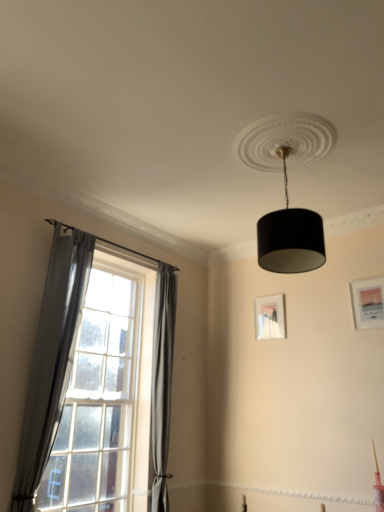
Locate an element on the screen. The height and width of the screenshot is (512, 384). clear glass window at left is located at coordinates (80, 385).

Describe the element at coordinates (80, 385) in the screenshot. The height and width of the screenshot is (512, 384). I see `clear glass window at left` at that location.

In order to face gray fabric curtain at left, the 1th curtain when ordered from front to back, should I rotate leftwards or rightwards?

You should look left and rotate roughly 17.153 degrees.

At what (x,y) coordinates should I click in order to perform the action: click on black textured lampshade at upper center. Please return your answer as a coordinate pair (x, y). Looking at the image, I should click on (290, 234).

Where is `clear glass window at left`? This screenshot has width=384, height=512. clear glass window at left is located at coordinates (80, 385).

Considering the relative sizes of clear glass window at left and gray fabric curtain at left, which is the 2th curtain from right to left, in the image provided, is clear glass window at left shorter than gray fabric curtain at left, which is the 2th curtain from right to left,?

In fact, clear glass window at left may be taller than gray fabric curtain at left, which is the 2th curtain from right to left.

Which object is further away from the camera, clear glass window at left or gray fabric curtain at left, arranged as the 1th curtain when viewed from the left?

Positioned behind is clear glass window at left.

How different are the orientations of clear glass window at left and gray fabric curtain at left, arranged as the 1th curtain when viewed from the left, in degrees?

The facing directions of clear glass window at left and gray fabric curtain at left, arranged as the 1th curtain when viewed from the left, are 3.49e-05 degrees apart.

How distant is clear glass window at left from gray fabric curtain at left, which is the 2th curtain from right to left?

The distance of clear glass window at left from gray fabric curtain at left, which is the 2th curtain from right to left, is 66.74 centimeters.

Looking at this image, from the image's perspective, is gray fabric curtain at left, the 2th curtain positioned from the front, located above matte white picture frame at center, positioned as the second picture frame in right-to-left order?

No, from the image's perspective, gray fabric curtain at left, the 2th curtain positioned from the front, is not above matte white picture frame at center, positioned as the second picture frame in right-to-left order.

Is gray fabric curtain at left, acting as the 1th curtain starting from the back, oriented away from matte white picture frame at center, the first picture frame from the left?

No.

Which of these two, gray fabric curtain at left, acting as the 1th curtain starting from the back, or matte white picture frame at center, positioned as the second picture frame in right-to-left order, is smaller?

matte white picture frame at center, positioned as the second picture frame in right-to-left order, is smaller.

Based on the photo, is the position of matte white picture frame at upper right, which ranks as the second picture frame in back-to-front order, less distant than that of black textured lampshade at upper center?

No, matte white picture frame at upper right, which ranks as the second picture frame in back-to-front order, is further to the viewer.

From the image's perspective, which is below, matte white picture frame at upper right, which ranks as the second picture frame in back-to-front order, or black textured lampshade at upper center?

matte white picture frame at upper right, which ranks as the second picture frame in back-to-front order, is shown below in the image.

Who is smaller, matte white picture frame at upper right, arranged as the second picture frame when viewed from the left, or black textured lampshade at upper center?

matte white picture frame at upper right, arranged as the second picture frame when viewed from the left.

Which is closer to the camera, (369, 324) or (315, 255)?

Point (369, 324) is farther from the camera than point (315, 255).

Looking at this image, is matte white picture frame at center, acting as the 1th picture frame starting from the back, surrounding gray fabric curtain at left, which is the second curtain from back to front?

That's incorrect, gray fabric curtain at left, which is the second curtain from back to front, is not inside matte white picture frame at center, acting as the 1th picture frame starting from the back.

From a real-world perspective, is matte white picture frame at center, positioned as the second picture frame in right-to-left order, positioned above or below gray fabric curtain at left, which is the second curtain from back to front?

In terms of real-world spatial position, matte white picture frame at center, positioned as the second picture frame in right-to-left order, is above gray fabric curtain at left, which is the second curtain from back to front.

Which object is thinner, matte white picture frame at center, positioned as the second picture frame in right-to-left order, or gray fabric curtain at left, which is the second curtain from back to front?

matte white picture frame at center, positioned as the second picture frame in right-to-left order.

In the scene shown: Is matte white picture frame at center, which ranks as the second picture frame in front-to-back order, beside gray fabric curtain at left, which is the 2th curtain from right to left?

No, matte white picture frame at center, which ranks as the second picture frame in front-to-back order, is not touching gray fabric curtain at left, which is the 2th curtain from right to left.

Considering the sizes of objects gray fabric curtain at left, which is the second curtain from back to front, and matte white picture frame at center, positioned as the second picture frame in right-to-left order, in the image provided, who is thinner, gray fabric curtain at left, which is the second curtain from back to front, or matte white picture frame at center, positioned as the second picture frame in right-to-left order,?

matte white picture frame at center, positioned as the second picture frame in right-to-left order.

From a real-world perspective, is gray fabric curtain at left, which is the 2th curtain from right to left, located higher than matte white picture frame at center, acting as the 1th picture frame starting from the back?

Actually, gray fabric curtain at left, which is the 2th curtain from right to left, is physically below matte white picture frame at center, acting as the 1th picture frame starting from the back, in the real world.

Between gray fabric curtain at left, arranged as the 1th curtain when viewed from the left, and matte white picture frame at center, the first picture frame from the left, which one has larger size?

gray fabric curtain at left, arranged as the 1th curtain when viewed from the left.

Which object is closer to the camera, gray fabric curtain at left, which is the second curtain from back to front, or matte white picture frame at center, positioned as the second picture frame in right-to-left order?

gray fabric curtain at left, which is the second curtain from back to front.

Is clear glass window at left a part of black textured lampshade at upper center?

That's incorrect, clear glass window at left is not inside black textured lampshade at upper center.

Where is `lamp above the clear glass window at left (from the image's perspective)`? lamp above the clear glass window at left (from the image's perspective) is located at coordinates (290, 234).

Can you confirm if black textured lampshade at upper center is bigger than clear glass window at left?

No.

Is matte white picture frame at center, which ranks as the second picture frame in front-to-back order, taller than gray fabric curtain at left, which ranks as the second curtain in left-to-right order?

Incorrect, the height of matte white picture frame at center, which ranks as the second picture frame in front-to-back order, is not larger of that of gray fabric curtain at left, which ranks as the second curtain in left-to-right order.

Does matte white picture frame at center, acting as the 1th picture frame starting from the back, touch gray fabric curtain at left, acting as the 1th curtain starting from the back?

No, matte white picture frame at center, acting as the 1th picture frame starting from the back, is not next to gray fabric curtain at left, acting as the 1th curtain starting from the back.

Measure the distance from matte white picture frame at center, positioned as the second picture frame in right-to-left order, to gray fabric curtain at left, which ranks as the second curtain in left-to-right order.

The distance of matte white picture frame at center, positioned as the second picture frame in right-to-left order, from gray fabric curtain at left, which ranks as the second curtain in left-to-right order, is 3.49 feet.

Choose the correct answer: Is matte white picture frame at center, positioned as the second picture frame in right-to-left order, inside gray fabric curtain at left, acting as the 1th curtain starting from the back, or outside it?

matte white picture frame at center, positioned as the second picture frame in right-to-left order, is located beyond the bounds of gray fabric curtain at left, acting as the 1th curtain starting from the back.

This screenshot has height=512, width=384. In order to click on curtain located above the clear glass window at left (from the image's perspective) in this screenshot , I will do `click(52, 358)`.

The width and height of the screenshot is (384, 512). In order to click on the 2nd curtain below when counting from the matte white picture frame at center, positioned as the second picture frame in right-to-left order (from the image's perspective) in this screenshot , I will do `click(162, 381)`.

Looking at the image, which one is located closer to matte white picture frame at upper right, acting as the 1th picture frame starting from the front, gray fabric curtain at left, the 2th curtain positioned from the front, or gray fabric curtain at left, which is the second curtain from back to front?

Among the two, gray fabric curtain at left, the 2th curtain positioned from the front, is located nearer to matte white picture frame at upper right, acting as the 1th picture frame starting from the front.

Based on their spatial positions, is black textured lampshade at upper center or gray fabric curtain at left, which is the 2th curtain from right to left, closer to clear glass window at left?

The object closer to clear glass window at left is gray fabric curtain at left, which is the 2th curtain from right to left.

When comparing their distances from gray fabric curtain at left, the 1th curtain when ordered from front to back, does clear glass window at left or black textured lampshade at upper center seem further?

Based on the image, black textured lampshade at upper center appears to be further to gray fabric curtain at left, the 1th curtain when ordered from front to back.

Considering their positions, is matte white picture frame at center, which ranks as the second picture frame in front-to-back order, positioned closer to gray fabric curtain at left, arranged as the 1th curtain when viewed from the left, than black textured lampshade at upper center?

Based on the image, black textured lampshade at upper center appears to be nearer to gray fabric curtain at left, arranged as the 1th curtain when viewed from the left.

Based on the photo, based on their spatial positions, is gray fabric curtain at left, the 1th curtain when ordered from front to back, or matte white picture frame at upper right, which is the first picture frame from right to left, closer to black textured lampshade at upper center?

matte white picture frame at upper right, which is the first picture frame from right to left, is closer to black textured lampshade at upper center.

When comparing their distances from gray fabric curtain at left, which ranks as the second curtain in left-to-right order, does black textured lampshade at upper center or matte white picture frame at upper right, acting as the 1th picture frame starting from the front, seem closer?

Based on the image, black textured lampshade at upper center appears to be nearer to gray fabric curtain at left, which ranks as the second curtain in left-to-right order.

Looking at the image, which one is located closer to gray fabric curtain at left, which ranks as the second curtain in left-to-right order, matte white picture frame at center, the first picture frame from the left, or clear glass window at left?

Among the two, clear glass window at left is located nearer to gray fabric curtain at left, which ranks as the second curtain in left-to-right order.

Estimate the real-world distances between objects in this image. Which object is closer to matte white picture frame at center, acting as the 1th picture frame starting from the back, gray fabric curtain at left, the 2th curtain positioned from the front, or matte white picture frame at upper right, arranged as the second picture frame when viewed from the left?

Among the two, matte white picture frame at upper right, arranged as the second picture frame when viewed from the left, is located nearer to matte white picture frame at center, acting as the 1th picture frame starting from the back.

Find the location of `picture frame between gray fabric curtain at left, which is the 2th curtain from right to left, and matte white picture frame at upper right, which ranks as the second picture frame in back-to-front order`. picture frame between gray fabric curtain at left, which is the 2th curtain from right to left, and matte white picture frame at upper right, which ranks as the second picture frame in back-to-front order is located at coordinates (270, 317).

Locate an element on the screen. The height and width of the screenshot is (512, 384). window between gray fabric curtain at left, the 1th curtain when ordered from front to back, and matte white picture frame at center, acting as the 1th picture frame starting from the back, from left to right is located at coordinates (80, 385).

This screenshot has width=384, height=512. Identify the location of curtain between gray fabric curtain at left, arranged as the 1th curtain when viewed from the left, and matte white picture frame at upper right, arranged as the second picture frame when viewed from the left. (162, 381).

Locate an element on the screen. curtain between gray fabric curtain at left, the 1th curtain when ordered from front to back, and black textured lampshade at upper center, in the horizontal direction is located at coordinates (162, 381).